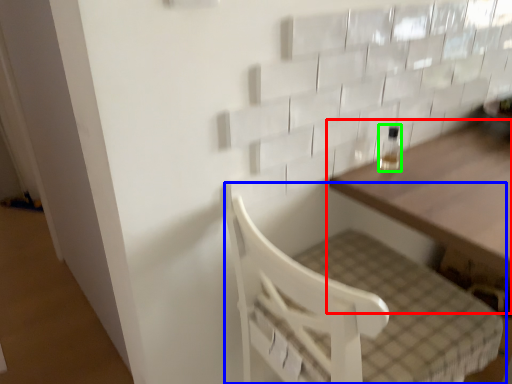
Question: Estimate the real-world distances between objects in this image. Which object is closer to table (highlighted by a red box), furniture (highlighted by a blue box) or bottle (highlighted by a green box)?

Choices:
 (A) furniture
 (B) bottle

Answer: (B)